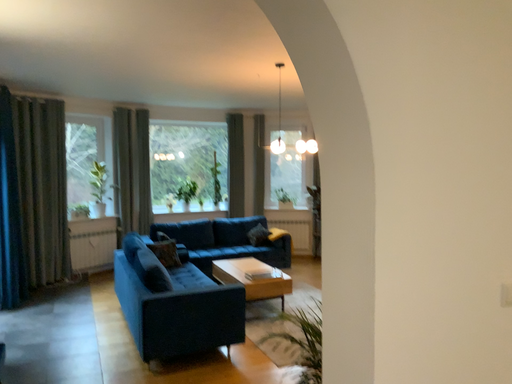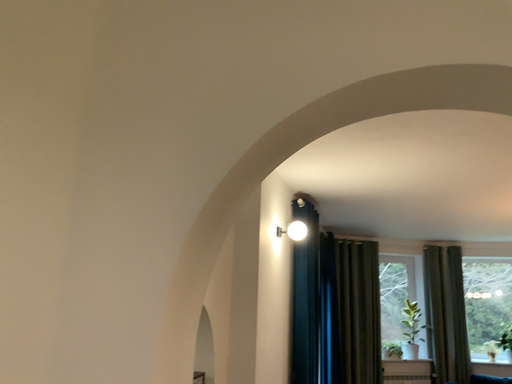
Question: Which way did the camera rotate in the video?

Choices:
 (A) rotated left
 (B) rotated right

Answer: (A)